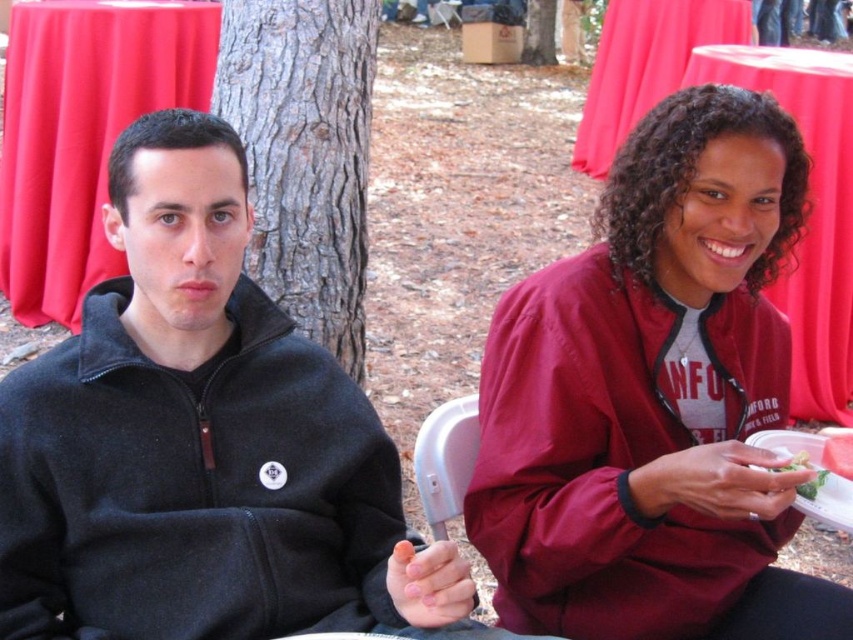
You are a photographer trying to capture a photo of the burgundy fabric jacket at center and the green leafy vegetable at right. Which object should you zoom in on to ensure both fit in the frame without distortion?

The burgundy fabric jacket at center is wider than the green leafy vegetable at right, so you should zoom in on the burgundy fabric jacket at center to ensure both fit in the frame without distortion.

You are at a park and see the brown rough bark at center and the green leafy salad at lower right. Which object is taller?

The brown rough bark at center is taller than the green leafy salad at lower right.

You are standing in the park and see the red cloth table at left. If you want to place a 3.5 meter long banner on the ground in front of the table, will it fit without overlapping the table?

The red cloth table at left is 3.69 meters from the viewer. Since the banner is 3.5 meters long, placing it on the ground in front of the table would leave enough space between the banner and the table, so it should fit without overlapping.